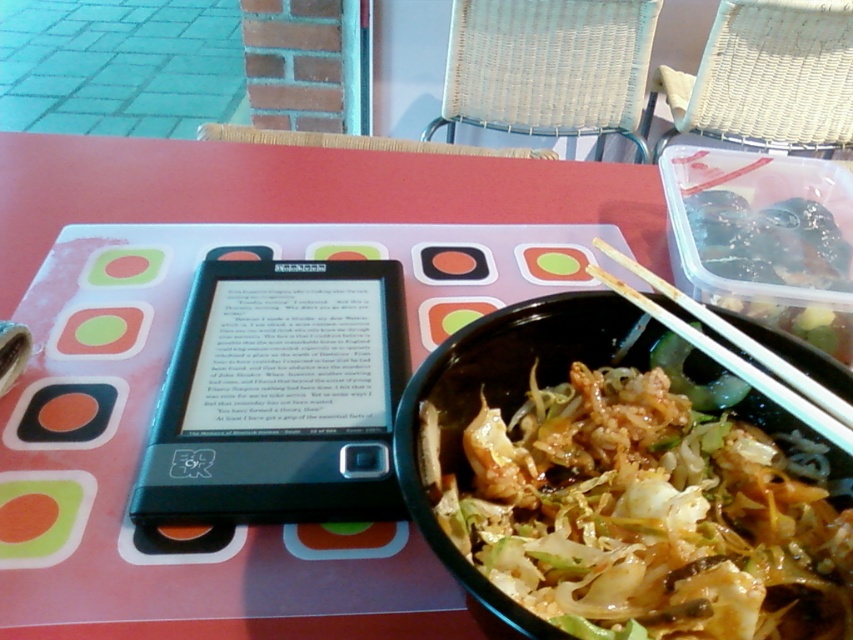
Which is above, black plastic bowl at lower right or wooden chopsticks at bowl right?

wooden chopsticks at bowl right is above.

Between black plastic bowl at lower right and wooden chopsticks at bowl right, which one has more height?

black plastic bowl at lower right is taller.

Is point (428, 499) farther from camera compared to point (697, 340)?

No, it is not.

Find the location of `black plastic bowl at lower right`. black plastic bowl at lower right is located at coordinates [x=498, y=404].

Is black plastic e-reader at center below black plastic bowl at lower right?

No, black plastic e-reader at center is not below black plastic bowl at lower right.

Is point (370, 502) farther from viewer compared to point (521, 605)?

Yes.

Who is more forward, [218,326] or [686,317]?

Positioned in front is point [686,317].

What are the coordinates of `black plastic e-reader at center` in the screenshot? It's located at (279, 396).

Between point (259, 260) and point (843, 419), which one is positioned behind?

The point (259, 260) is more distant.

Who is more distant from viewer, (x=233, y=502) or (x=827, y=420)?

Positioned behind is point (x=233, y=502).

Where is `black plastic e-reader at center`? The width and height of the screenshot is (853, 640). black plastic e-reader at center is located at coordinates (279, 396).